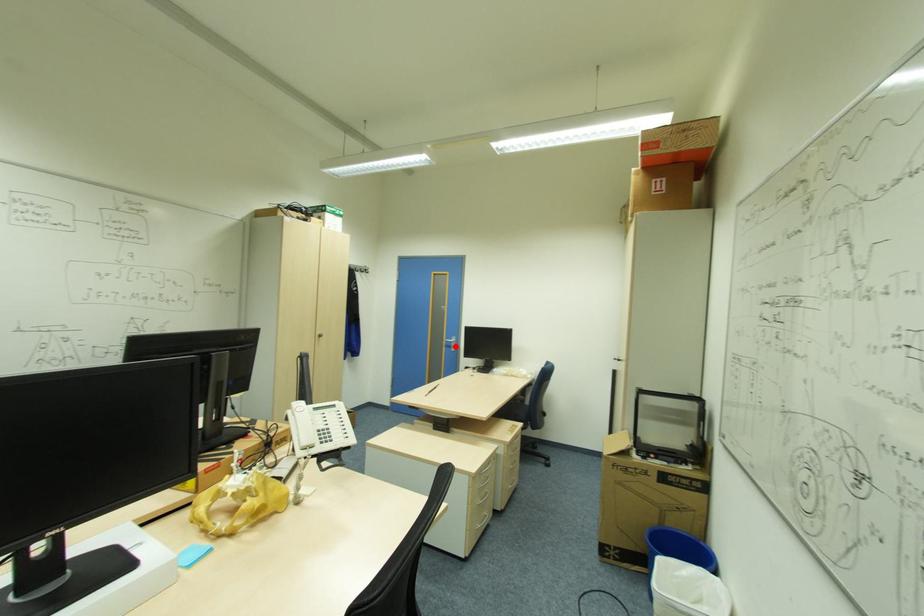
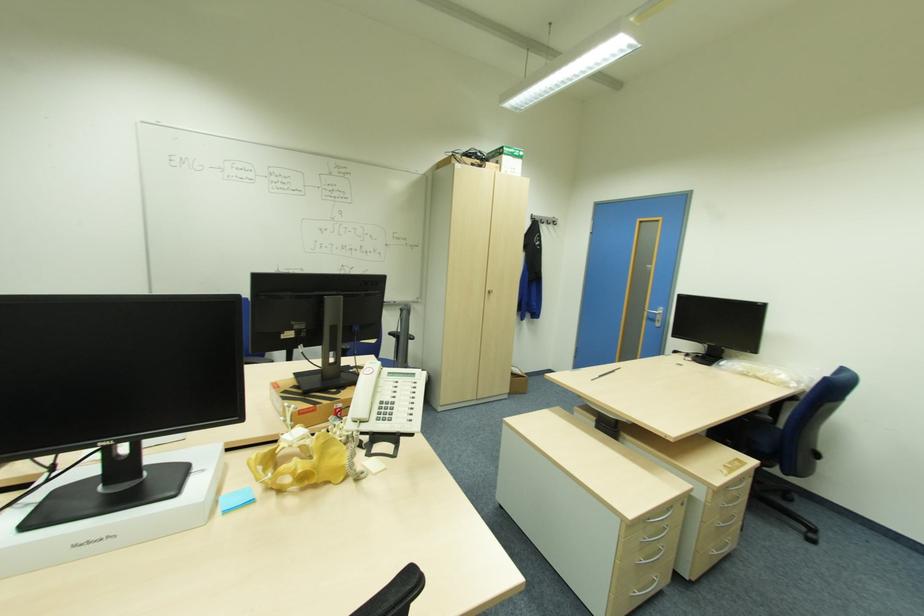
Find the pixel in the second image that matches the highlighted location in the first image.

(661, 321)